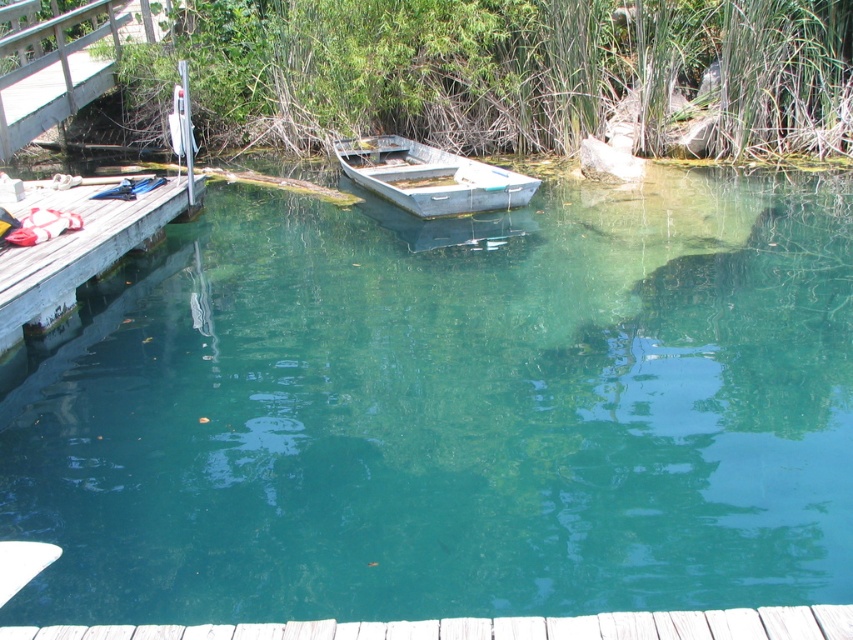
Is green translucent water at center smaller than wooden dock at left?

No, green translucent water at center is not smaller than wooden dock at left.

Is point (612, 202) farther from camera compared to point (73, 273)?

Yes, point (612, 202) is farther from viewer.

The width and height of the screenshot is (853, 640). Find the location of `green translucent water at center`. green translucent water at center is located at coordinates (450, 410).

Does point (154, 202) come farther from viewer compared to point (363, 184)?

No, it is in front of (363, 184).

Is wooden dock at left wider than metallic gray boat at center?

No.

Does point (138, 232) come closer to viewer compared to point (402, 164)?

Yes, point (138, 232) is in front of point (402, 164).

Find the location of a particular element. wooden dock at left is located at coordinates (74, 248).

Does green translucent water at center come in front of metallic gray boat at center?

Yes, green translucent water at center is closer to the viewer.

Does green translucent water at center appear over metallic gray boat at center?

Incorrect, green translucent water at center is not positioned above metallic gray boat at center.

Is point (724, 484) less distant than point (357, 173)?

Yes, it is in front of point (357, 173).

This screenshot has height=640, width=853. In order to click on green translucent water at center in this screenshot , I will do `click(450, 410)`.